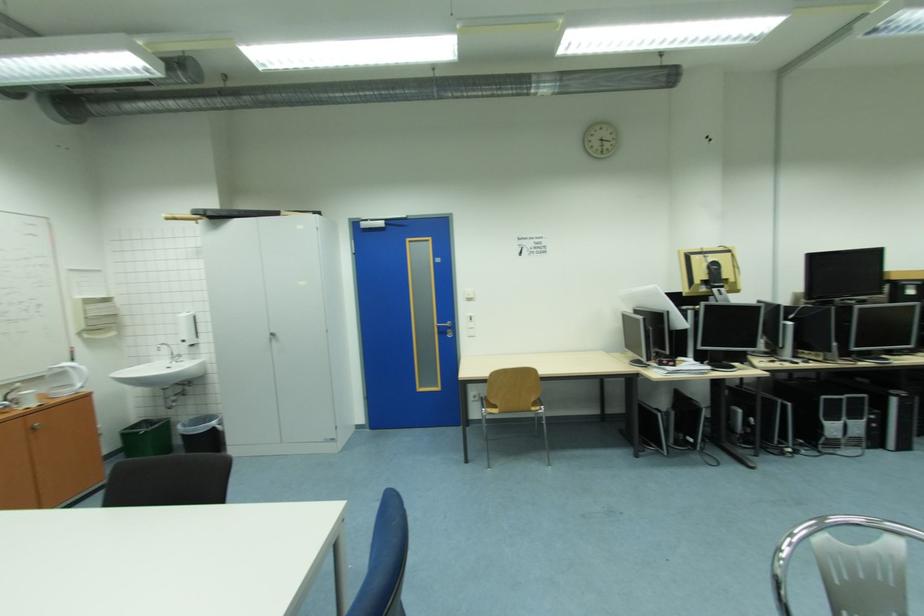
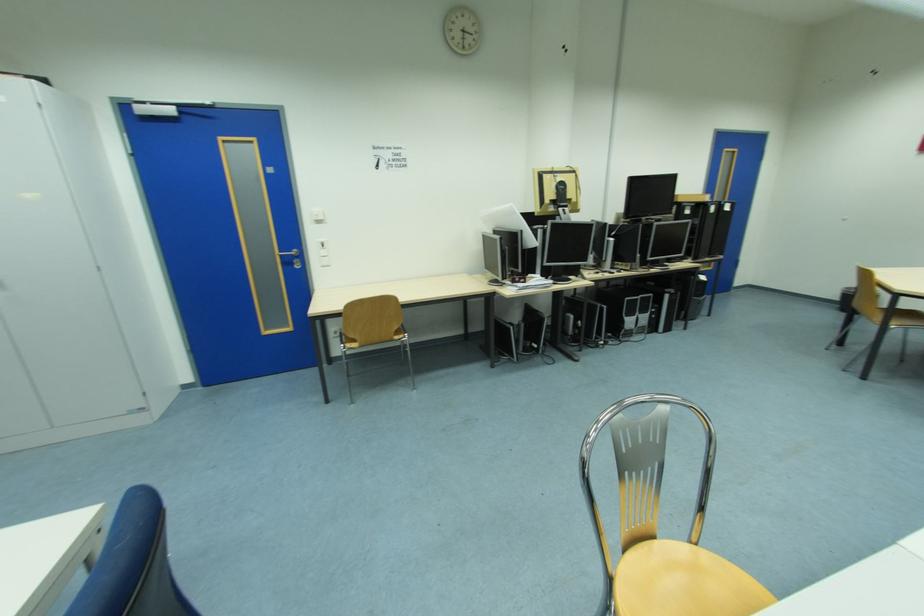
Question: The camera is either moving clockwise (left) or counter-clockwise (right) around the object. The first image is from the beginning of the video and the second image is from the end. Is the camera moving left or right when shooting the video?

Choices:
 (A) Left
 (B) Right

Answer: (A)